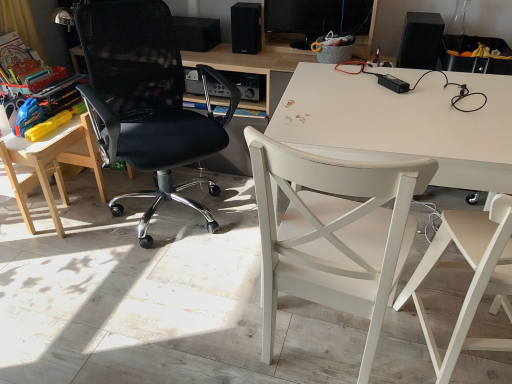
Identify the location of vacant area that lies between white wood chair at center, the 3th chair viewed from the left, and light wood/wooden chair at left, placed as the first chair when sorted from left to right. Image resolution: width=512 pixels, height=384 pixels. (161, 276).